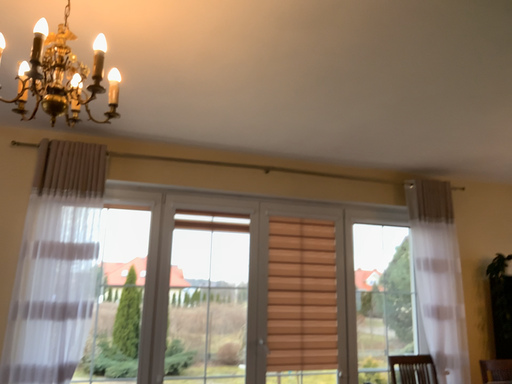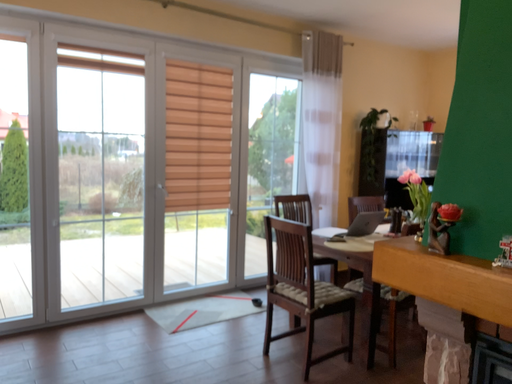
Question: Which way did the camera rotate in the video?

Choices:
 (A) rotated right
 (B) rotated left

Answer: (A)